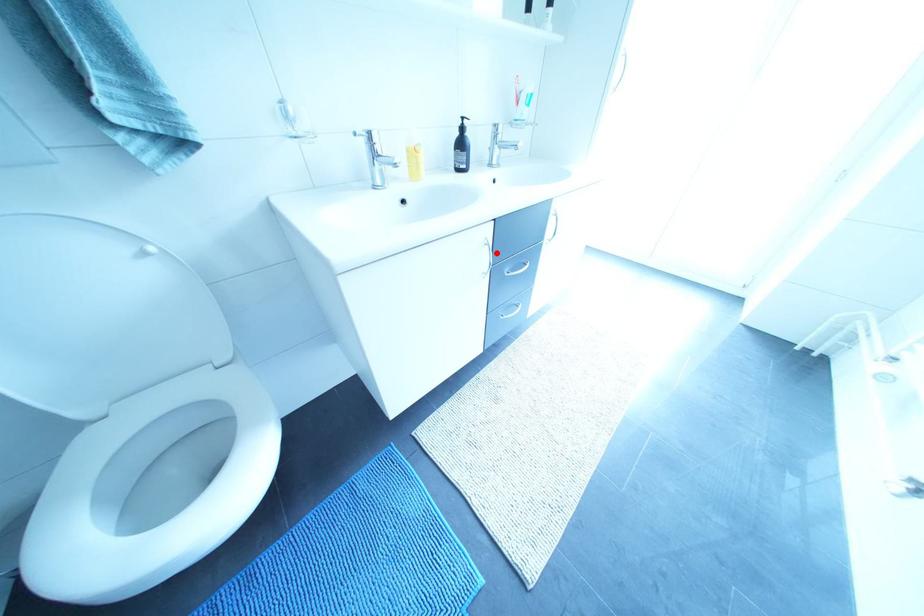
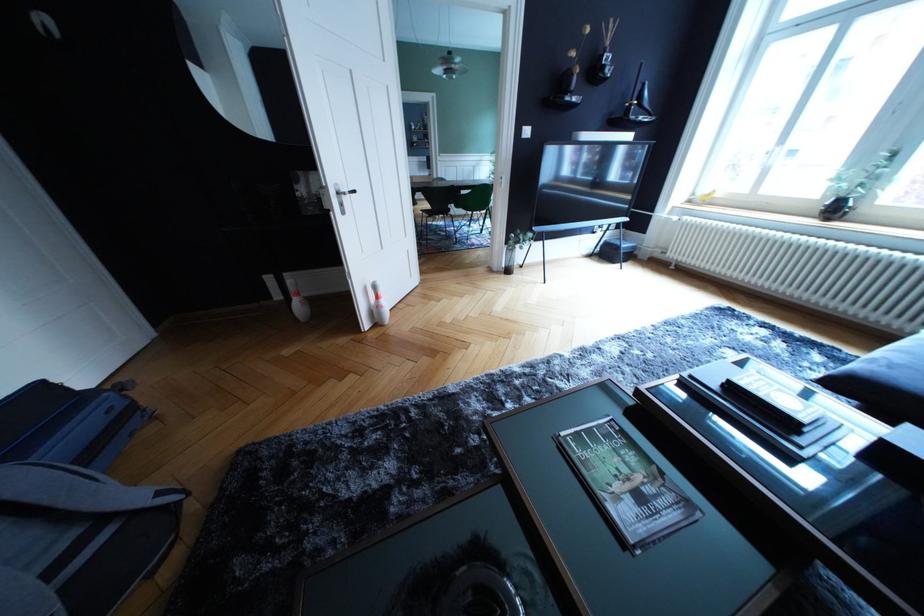
Question: I am providing you with two images of the same scene from different viewpoints. A red point is marked on the first image. Can you still see the location of the red point in image 2?

Choices:
 (A) Yes
 (B) No

Answer: (B)